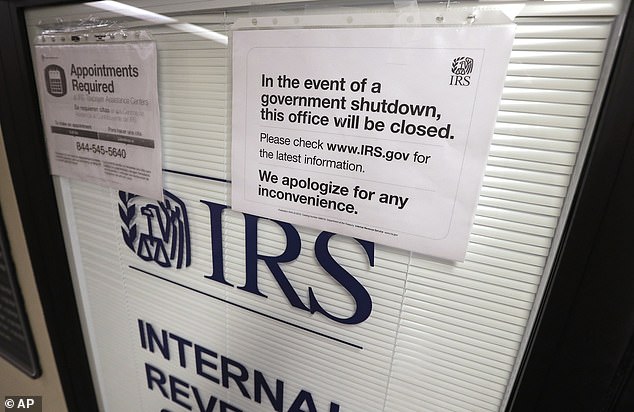
Identify the location of black door. Image resolution: width=634 pixels, height=412 pixels. pos(605,350).